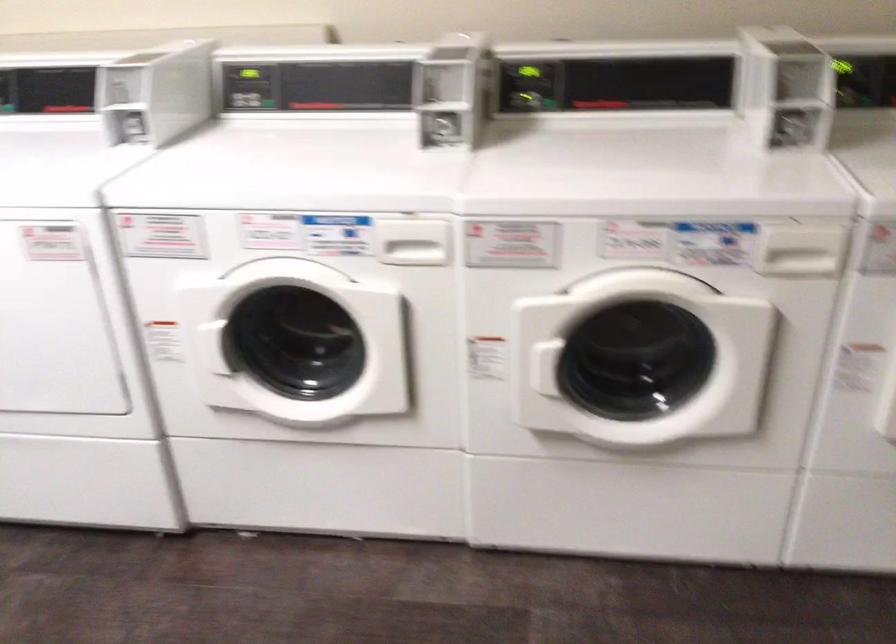
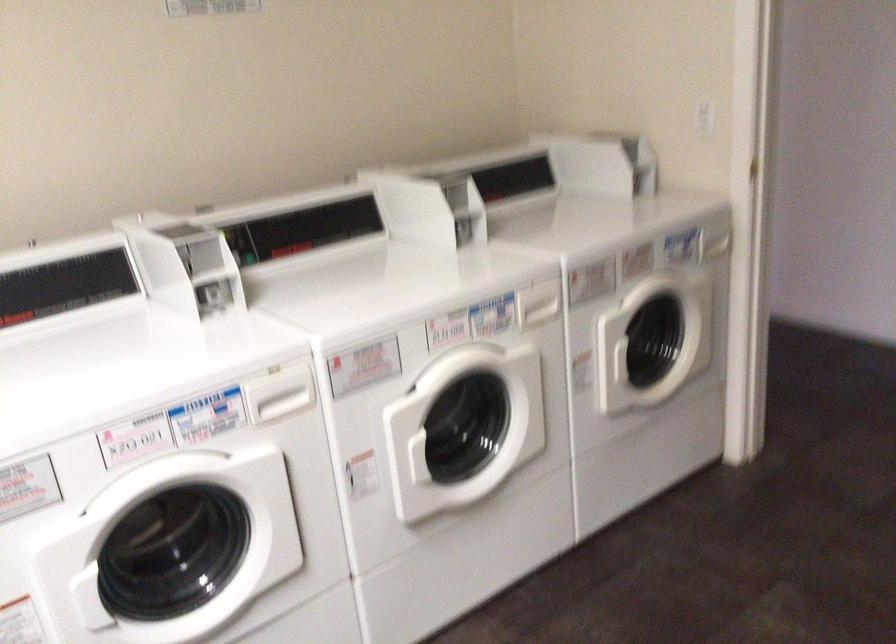
Find the pixel in the second image that matches [332,223] in the first image.

(200, 406)